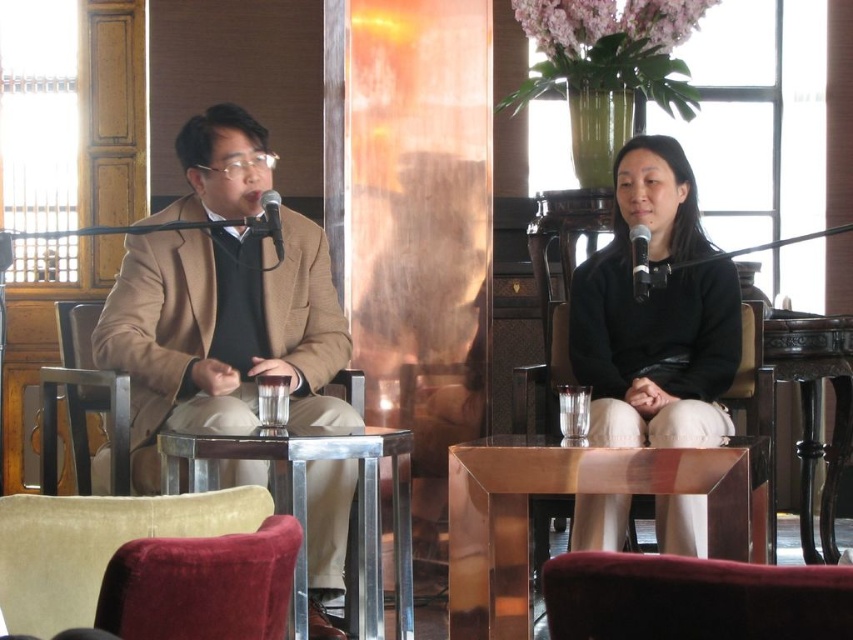
You are a fashion designer who needs to locate the matte brown blazer at left in the image. What are the coordinates where you can find it?

The coordinates for the matte brown blazer at left are at point [222,332].

You are a photographer setting up for a photoshoot. You need to place a large camera on the metallic silver table at center and a small tripod on the black polished wood table at right. Which table will require you to adjust the camera height to ensure both setups are at eye level?

The metallic silver table at center is below the black polished wood table at right, so placing the large camera on the lower table and the small tripod on the higher table means you will need to adjust the camera height on the metallic silver table at center to match the eye level of the setup on the black polished wood table at right.

You are a photographer positioned in front of the scene. You need to capture a clear photo of both the matte brown blazer at left and the black polished wood table at right. Which object should you focus on first to ensure both are in focus?

You should focus on the matte brown blazer at left first because it is closer to the viewer than the black polished wood table at right, so adjusting focus from near to far will help both objects be in focus.